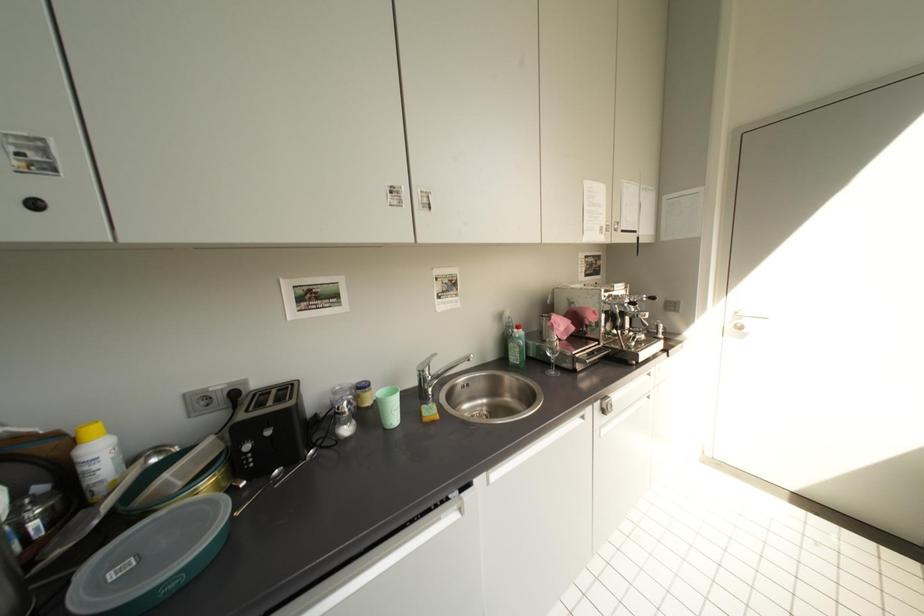
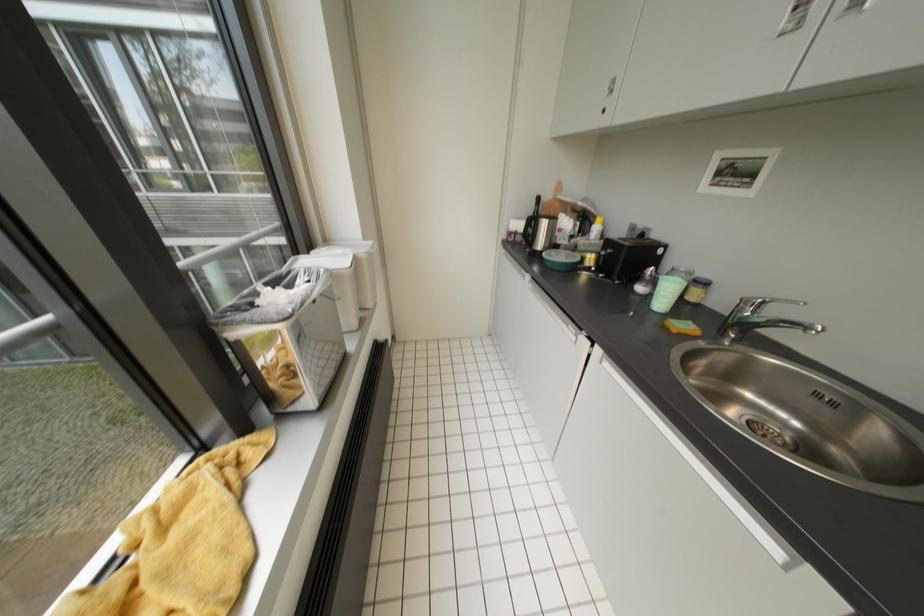
The first image is from the beginning of the video and the second image is from the end. How did the camera likely rotate when shooting the video?

The camera's rotation is toward left-down.